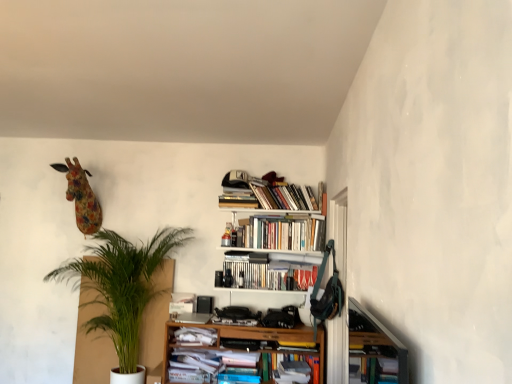
Locate an element on the screen. free space above white wooden bookshelf at upper center (from a real-world perspective) is located at coordinates (269, 211).